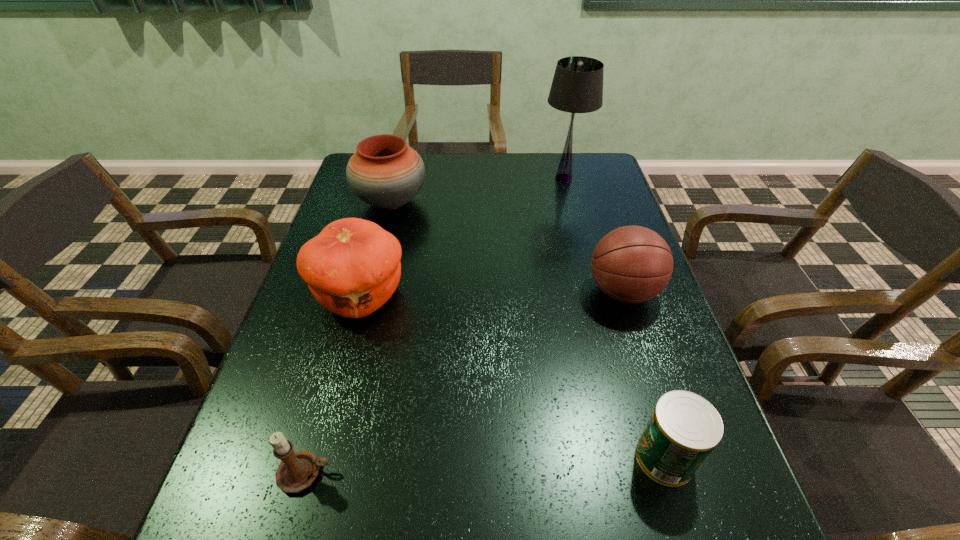
At what (x,y) coordinates should I click in order to perform the action: click on empty location between the lampshade and the basketball. Please return your answer as a coordinate pair (x, y). The height and width of the screenshot is (540, 960). Looking at the image, I should click on (593, 235).

Locate an element on the screen. This screenshot has height=540, width=960. free space between the pottery and the basketball is located at coordinates (507, 247).

Find the location of a particular element. This screenshot has height=540, width=960. blank region between the candle holder and the lampshade is located at coordinates (434, 326).

You are a GUI agent. You are given a task and a screenshot of the screen. Output one action in this format:
    pyautogui.click(x=<x>, y=<y>)
    Task: Click on the empty location between the can and the tallest object
    The width and height of the screenshot is (960, 540).
    Given the screenshot: What is the action you would take?
    pyautogui.click(x=614, y=318)

Image resolution: width=960 pixels, height=540 pixels. I want to click on empty space that is in between the can and the tallest object, so pos(614,318).

You are a GUI agent. You are given a task and a screenshot of the screen. Output one action in this format:
    pyautogui.click(x=<x>, y=<y>)
    Task: Click on the free space between the pumpkin and the basketball
    The height and width of the screenshot is (540, 960).
    Given the screenshot: What is the action you would take?
    pyautogui.click(x=492, y=293)

Image resolution: width=960 pixels, height=540 pixels. Identify the location of free space between the pottery and the can. (528, 330).

The image size is (960, 540). I want to click on free space between the basketball and the tallest object, so click(x=593, y=235).

Select which object is the closest to the pumpkin. Please provide its 2D coordinates. Your answer should be formatted as a tuple, i.e. [(x, y)], where the tuple contains the x and y coordinates of a point satisfying the conditions above.

[(384, 172)]

Identify which object is located as the third nearest to the can. Please provide its 2D coordinates. Your answer should be formatted as a tuple, i.e. [(x, y)], where the tuple contains the x and y coordinates of a point satisfying the conditions above.

[(297, 470)]